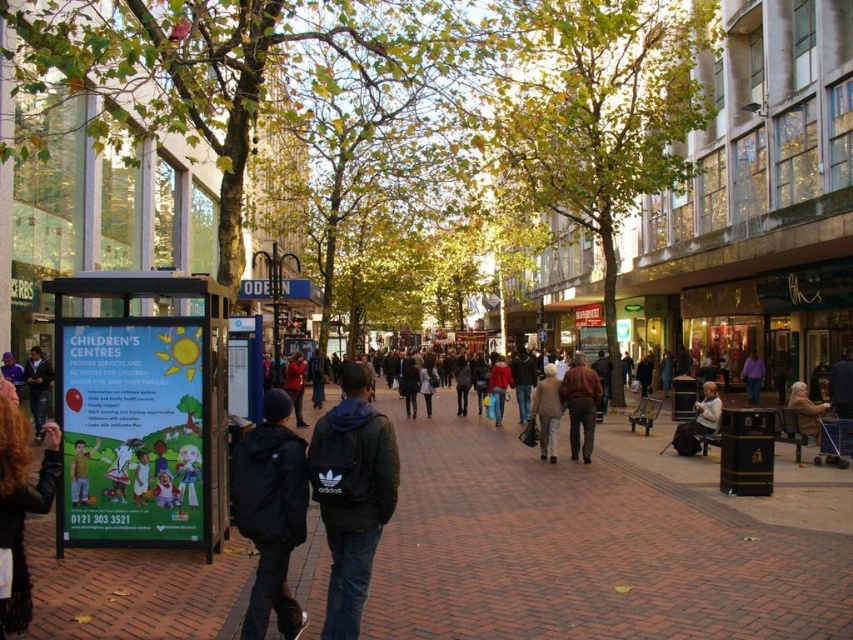
Is point (370, 381) in front of point (750, 372)?

Yes.

Describe the element at coordinates (352, 497) in the screenshot. I see `black adidas backpack at center` at that location.

Identify the location of black adidas backpack at center. (352, 497).

Is dark blue hoodie at left bigger than matte red jacket at center?

Yes, dark blue hoodie at left is bigger than matte red jacket at center.

Between dark blue hoodie at left and matte red jacket at center, which one appears on the right side from the viewer's perspective?

matte red jacket at center

Where is `dark blue hoodie at left`? dark blue hoodie at left is located at coordinates (38, 387).

Is red matte jacket at center smaller than dark brown leather jacket at center?

Incorrect, red matte jacket at center is not smaller in size than dark brown leather jacket at center.

Is point (508, 365) closer to viewer compared to point (756, 387)?

Yes, it is.

You are a GUI agent. You are given a task and a screenshot of the screen. Output one action in this format:
    pyautogui.click(x=<x>, y=<y>)
    Task: Click on the red matte jacket at center
    The width and height of the screenshot is (853, 640).
    Given the screenshot: What is the action you would take?
    pyautogui.click(x=498, y=387)